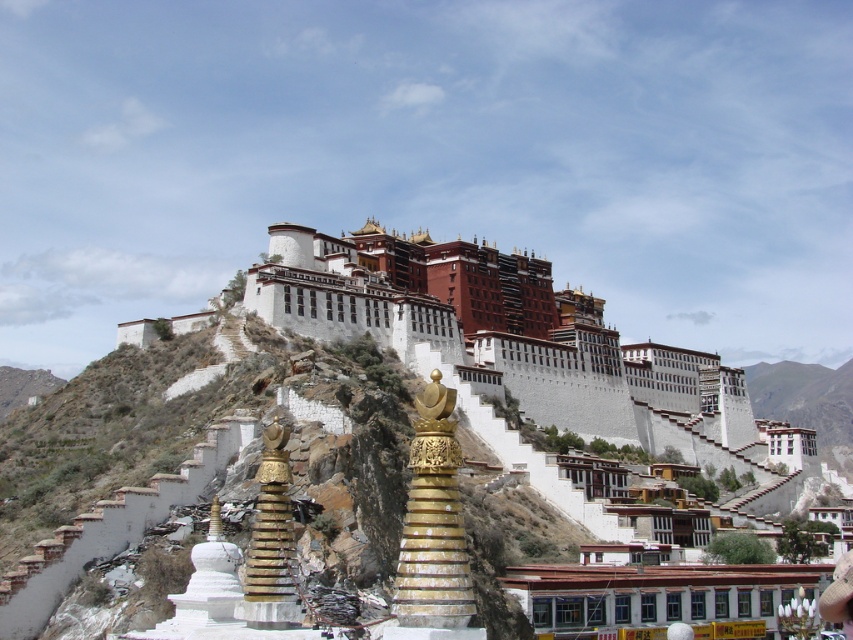
Is white stone building at upper center smaller than gold metallic stupa at center?

No, white stone building at upper center is not smaller than gold metallic stupa at center.

Is the position of white stone building at upper center less distant than that of gold metallic stupa at center?

No, it is behind gold metallic stupa at center.

Which is behind, point (590, 300) or point (257, 468)?

Point (590, 300)

You are a GUI agent. You are given a task and a screenshot of the screen. Output one action in this format:
    pyautogui.click(x=<x>, y=<y>)
    Task: Click on the white stone building at upper center
    This screenshot has width=853, height=640.
    Given the screenshot: What is the action you would take?
    pyautogui.click(x=524, y=348)

Is point (427, 426) positioned before point (252, 532)?

Yes, point (427, 426) is closer to viewer.

Which is more to the left, gold polished stupa at center or gold metallic stupa at center?

gold metallic stupa at center is more to the left.

Where is `gold polished stupa at center`? gold polished stupa at center is located at coordinates (433, 528).

You are a GUI agent. You are given a task and a screenshot of the screen. Output one action in this format:
    pyautogui.click(x=<x>, y=<y>)
    Task: Click on the white stone building at upper center
    
    Given the screenshot: What is the action you would take?
    pyautogui.click(x=524, y=348)

Image resolution: width=853 pixels, height=640 pixels. In order to click on white stone building at upper center in this screenshot , I will do `click(524, 348)`.